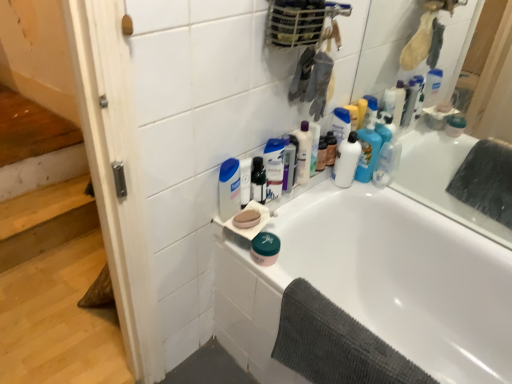
Locate an element on the screen. free location above dark gray textured towel at lower right (from a real-world perspective) is located at coordinates (349, 332).